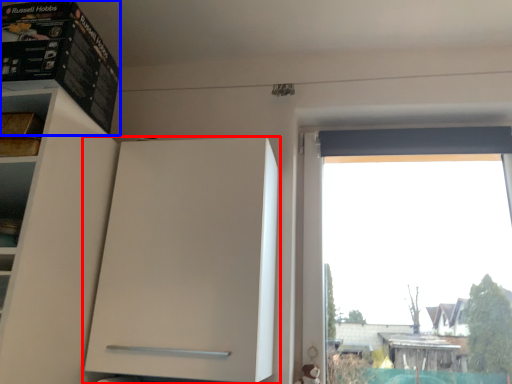
Question: Which object appears closest to the camera in this image, cabinetry (highlighted by a red box) or cabinet (highlighted by a blue box)?

Choices:
 (A) cabinetry
 (B) cabinet

Answer: (B)